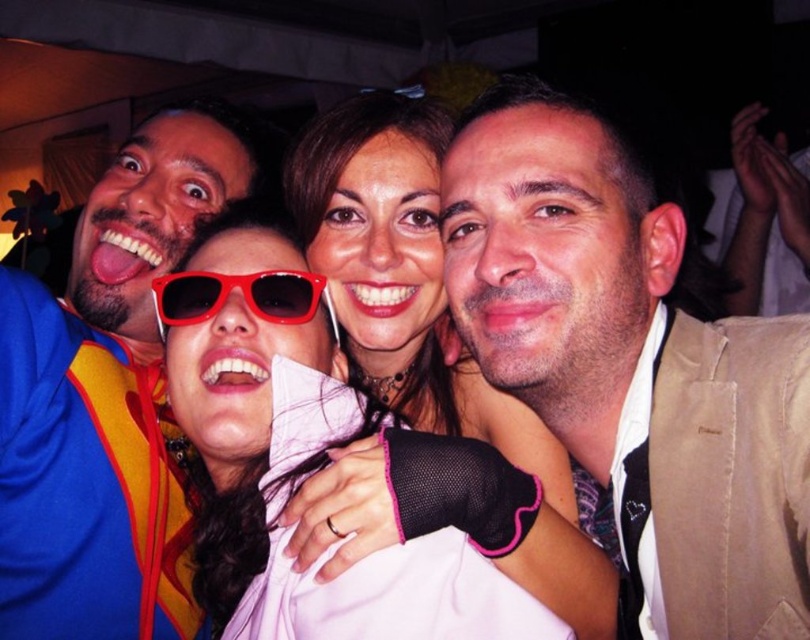
You are at a party and see two jackets hanging on a rack. The beige textured jacket at upper right and the blue fleece jacket at upper left. Which jacket is positioned lower on the rack?

The beige textured jacket at upper right is located below the blue fleece jacket at upper left, so it is positioned lower on the rack.